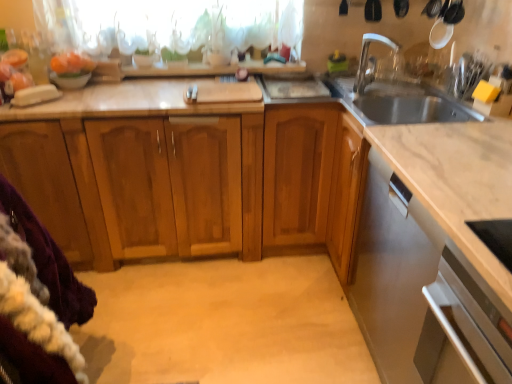
I want to click on free space behind white glossy faucet at upper right, so click(x=360, y=90).